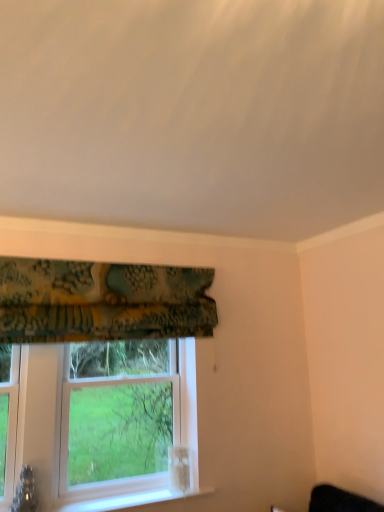
What is the approximate width of white plastic window at center?

24.52 centimeters.

Find the location of a particular element. This screenshot has height=512, width=384. white plastic window at center is located at coordinates (118, 432).

Describe the element at coordinates (118, 432) in the screenshot. The width and height of the screenshot is (384, 512). I see `white plastic window at center` at that location.

Describe the element at coordinates (102, 301) in the screenshot. I see `textured green fabric at upper left` at that location.

Find the location of a particular element. The height and width of the screenshot is (512, 384). textured green fabric at upper left is located at coordinates (102, 301).

Find the location of a particular element. white plastic window at center is located at coordinates (118, 432).

Which object is positioned more to the left, white plastic window at center or textured green fabric at upper left?

From the viewer's perspective, white plastic window at center appears more on the left side.

Considering their positions, is white plastic window at center located in front of or behind textured green fabric at upper left?

Clearly, white plastic window at center is behind textured green fabric at upper left.

Which is behind, point (95, 440) or point (1, 329)?

Positioned behind is point (95, 440).

From the image's perspective, who appears lower, white plastic window at center or textured green fabric at upper left?

white plastic window at center, from the image's perspective.

From a real-world perspective, is white plastic window at center below textured green fabric at upper left?

Indeed, from a real-world perspective, white plastic window at center is positioned beneath textured green fabric at upper left.

Does white plastic window at center have a lesser width compared to textured green fabric at upper left?

No.

Which of these two, white plastic window at center or textured green fabric at upper left, stands taller?

With more height is white plastic window at center.

In terms of size, does white plastic window at center appear bigger or smaller than textured green fabric at upper left?

In the image, white plastic window at center appears to be larger than textured green fabric at upper left.

Could textured green fabric at upper left be considered to be inside white plastic window at center?

No, textured green fabric at upper left is not a part of white plastic window at center.

Are white plastic window at center and textured green fabric at upper left far apart?

That's not correct — white plastic window at center is a little close to textured green fabric at upper left.

Is white plastic window at center looking in the opposite direction of textured green fabric at upper left?

No, textured green fabric at upper left is not at the back of white plastic window at center.

Can you tell me how much white plastic window at center and textured green fabric at upper left differ in facing direction?

The angular difference between white plastic window at center and textured green fabric at upper left is 0.798 degrees.

How much distance is there between white plastic window at center and textured green fabric at upper left?

The distance of white plastic window at center from textured green fabric at upper left is 26.32 inches.

Where is `window below the textured green fabric at upper left (from the image's perspective)`? The image size is (384, 512). window below the textured green fabric at upper left (from the image's perspective) is located at coordinates (118, 432).

Does textured green fabric at upper left appear on the left side of white plastic window at center?

No.

Considering the relative positions of textured green fabric at upper left and white plastic window at center in the image provided, is textured green fabric at upper left in front of white plastic window at center?

That is True.

Is point (122, 295) positioned behind point (123, 485)?

No, it is not.

From the image's perspective, is textured green fabric at upper left above or below white plastic window at center?

Clearly, from the image's perspective, textured green fabric at upper left is above white plastic window at center.

From a real-world perspective, is textured green fabric at upper left over white plastic window at center?

Yes, from a real-world perspective, textured green fabric at upper left is above white plastic window at center.

Between textured green fabric at upper left and white plastic window at center, which one has larger width?

With larger width is white plastic window at center.

Considering the sizes of objects textured green fabric at upper left and white plastic window at center in the image provided, who is taller, textured green fabric at upper left or white plastic window at center?

white plastic window at center.

Which of these two, textured green fabric at upper left or white plastic window at center, is bigger?

white plastic window at center.

Choose the correct answer: Is textured green fabric at upper left inside white plastic window at center or outside it?

textured green fabric at upper left is located beyond the bounds of white plastic window at center.

Is textured green fabric at upper left touching white plastic window at center?

They are not placed beside each other.

Is textured green fabric at upper left positioned with its back to white plastic window at center?

No, textured green fabric at upper left is not facing the opposite direction of white plastic window at center.

You are a GUI agent. You are given a task and a screenshot of the screen. Output one action in this format:
    pyautogui.click(x=<x>, y=<y>)
    Task: Click on the window located on the left of textured green fabric at upper left
    This screenshot has height=512, width=384.
    Given the screenshot: What is the action you would take?
    pyautogui.click(x=118, y=432)

At what (x,y) coordinates should I click in order to perform the action: click on curtain above the white plastic window at center (from the image's perspective). Please return your answer as a coordinate pair (x, y). The height and width of the screenshot is (512, 384). Looking at the image, I should click on (102, 301).

Locate an element on the screen. This screenshot has width=384, height=512. window below the textured green fabric at upper left (from a real-world perspective) is located at coordinates (118, 432).